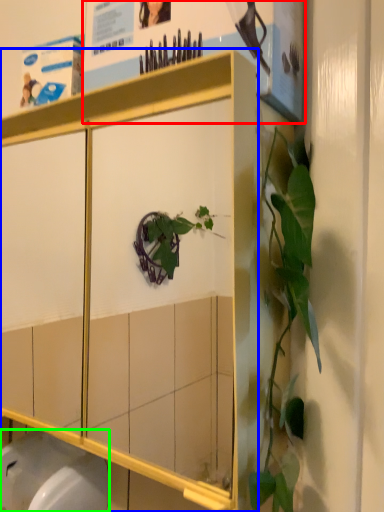
Question: Based on their relative distances, which object is nearer to poster page (highlighted by a red box)? Choose from cabinetry (highlighted by a blue box) and toilet bowl (highlighted by a green box).

Choices:
 (A) cabinetry
 (B) toilet bowl

Answer: (A)